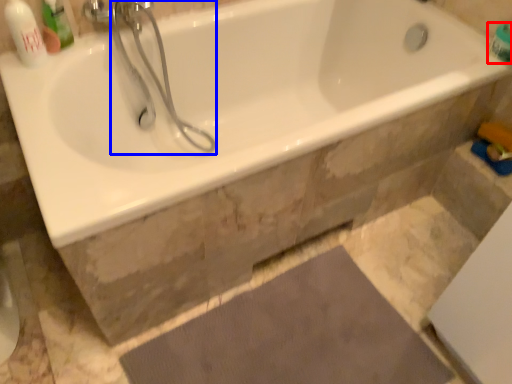
Question: Which object appears farthest to the camera in this image, toiletry (highlighted by a red box) or shower (highlighted by a blue box)?

Choices:
 (A) toiletry
 (B) shower

Answer: (A)